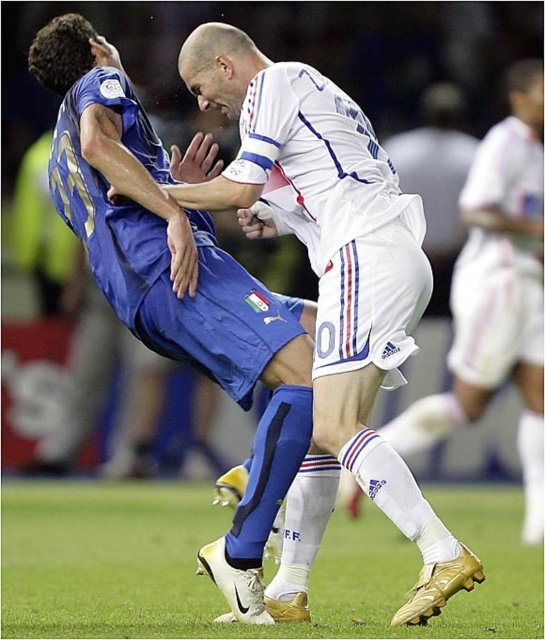
Question: Does blue fabric jersey at center appear over white smooth shorts at center?

Choices:
 (A) no
 (B) yes

Answer: (A)

Question: Among these objects, which one is farthest from the camera?

Choices:
 (A) green grass at center
 (B) white smooth shorts at center
 (C) white smooth soccer player at center

Answer: (B)

Question: Can you confirm if white smooth soccer player at center is wider than green grass at center?

Choices:
 (A) no
 (B) yes

Answer: (B)

Question: Among these objects, which one is nearest to the camera?

Choices:
 (A) white smooth shorts at center
 (B) blue fabric jersey at center

Answer: (B)

Question: Is green grass at center further to camera compared to white smooth shorts at center?

Choices:
 (A) yes
 (B) no

Answer: (B)

Question: Among these objects, which one is farthest from the camera?

Choices:
 (A) white smooth soccer player at center
 (B) green grass at center

Answer: (B)